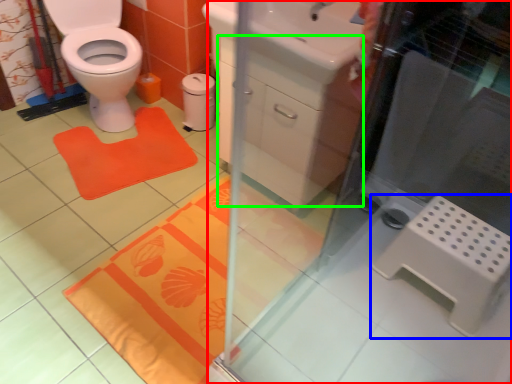
Question: Which object is positioned farthest from screen door (highlighted by a red box)? Select from step stool (highlighted by a blue box) and drawer (highlighted by a green box).

Choices:
 (A) step stool
 (B) drawer

Answer: (B)